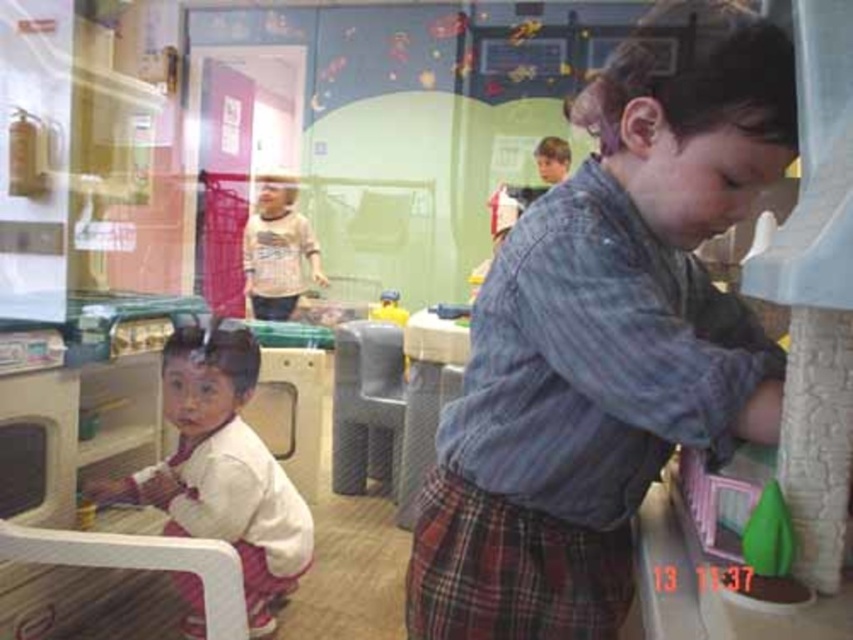
How much distance is there between plaid fabric skirt at lower center and striped cotton shirt at center?

They are 3.95 feet apart.

Is point (576, 595) more distant than point (260, 280)?

No, (576, 595) is closer to viewer.

Describe the element at coordinates (509, 570) in the screenshot. The width and height of the screenshot is (853, 640). I see `plaid fabric skirt at lower center` at that location.

This screenshot has height=640, width=853. What are the coordinates of `plaid fabric skirt at lower center` in the screenshot? It's located at (509, 570).

Find the location of a particular element. The height and width of the screenshot is (640, 853). matte gray chair at center is located at coordinates (366, 406).

Where is `matte gray chair at center`? This screenshot has height=640, width=853. matte gray chair at center is located at coordinates (366, 406).

Measure the distance between plaid fabric skirt at lower center and matte gray chair at center.

A distance of 3.78 feet exists between plaid fabric skirt at lower center and matte gray chair at center.

Is point (601, 544) positioned before point (341, 472)?

Yes, it is.

Does point (456, 628) lie behind point (350, 481)?

That is False.

Locate an element on the screen. The height and width of the screenshot is (640, 853). plaid fabric skirt at lower center is located at coordinates (509, 570).